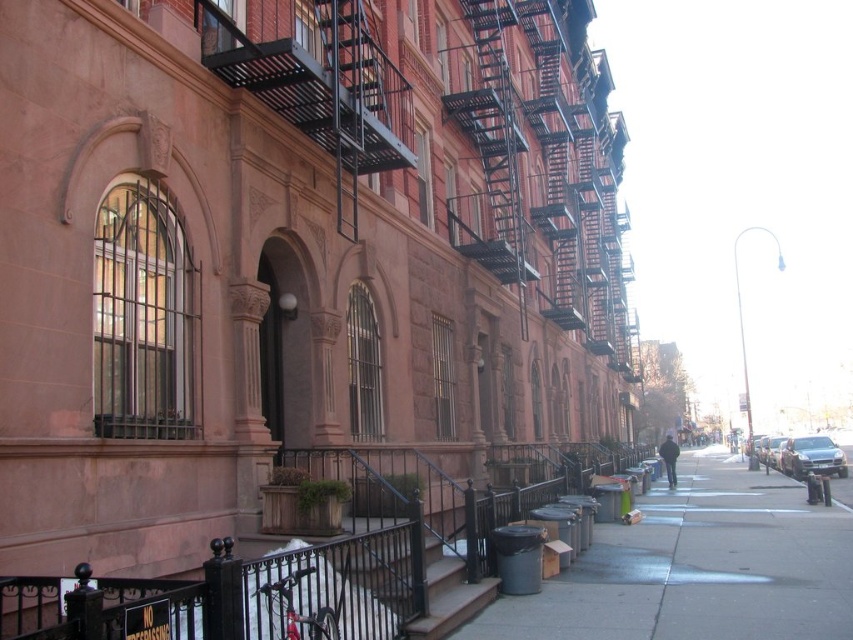
Question: Does smooth concrete sidewalk at lower center have a greater width compared to shiny silver sedan at center right?

Choices:
 (A) no
 (B) yes

Answer: (B)

Question: Does smooth concrete sidewalk at lower center come behind shiny silver sedan at center right?

Choices:
 (A) yes
 (B) no

Answer: (B)

Question: Which point appears farthest from the camera in this image?

Choices:
 (A) (785, 458)
 (B) (471, 584)
 (C) (728, 508)

Answer: (A)

Question: Which point is farther from the camera taking this photo?

Choices:
 (A) (810, 451)
 (B) (466, 584)
 (C) (747, 477)

Answer: (C)

Question: Is the position of smooth concrete sidewalk at lower center more distant than that of brown wood stairs at center?

Choices:
 (A) no
 (B) yes

Answer: (B)

Question: Which object appears farthest from the camera in this image?

Choices:
 (A) brown wood stairs at center
 (B) shiny silver sedan at center right
 (C) smooth concrete sidewalk at lower center

Answer: (B)